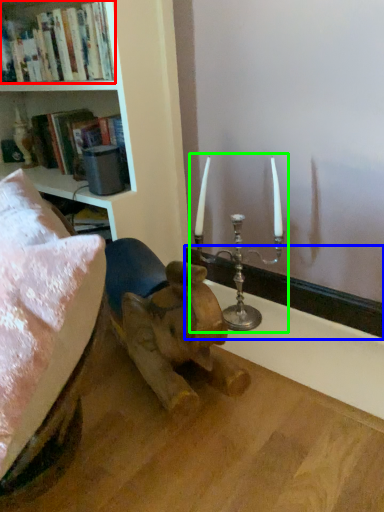
Question: Which object is the farthest from book (highlighted by a red box)? Choose among these: window sill (highlighted by a blue box) or candle holder (highlighted by a green box).

Choices:
 (A) window sill
 (B) candle holder

Answer: (A)